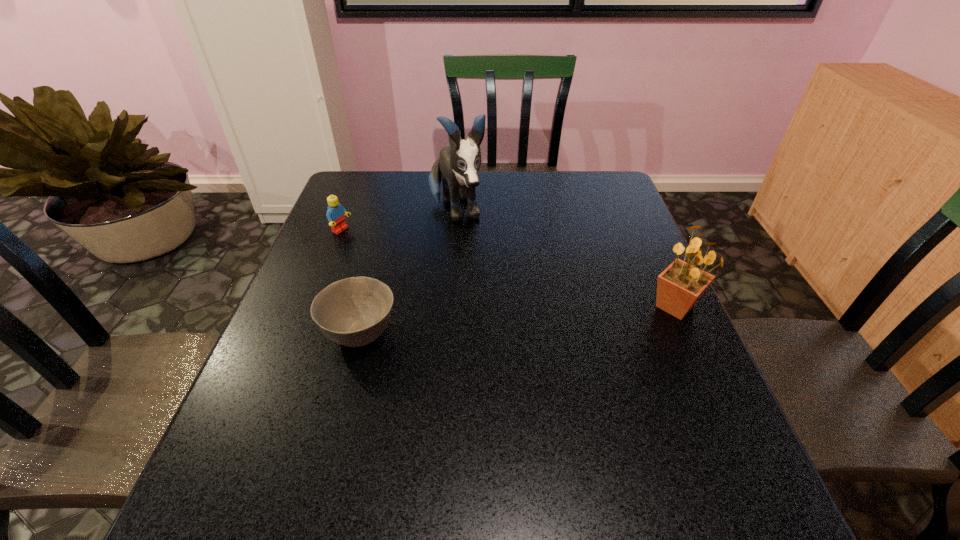
Where is `vacant area situated on the face of the Lego`? vacant area situated on the face of the Lego is located at coordinates (399, 258).

Locate an element on the screen. This screenshot has width=960, height=540. vacant space positioned on the front-facing side of the tallest object is located at coordinates (469, 254).

Where is `free spot located 0.070m on the front-facing side of the tallest object`? Image resolution: width=960 pixels, height=540 pixels. free spot located 0.070m on the front-facing side of the tallest object is located at coordinates click(x=469, y=254).

The width and height of the screenshot is (960, 540). I want to click on vacant space located on the front-facing side of the tallest object, so click(x=469, y=254).

At what (x,y) coordinates should I click in order to perform the action: click on object located at the far edge. Please return your answer as a coordinate pair (x, y). Looking at the image, I should click on (458, 165).

Where is `bowl that is at the left edge`? The image size is (960, 540). bowl that is at the left edge is located at coordinates (353, 312).

Find the location of `Lego that is at the left edge`. Lego that is at the left edge is located at coordinates (335, 214).

The image size is (960, 540). What are the coordinates of `object situated at the right edge` in the screenshot? It's located at (681, 284).

At what (x,y) coordinates should I click in order to perform the action: click on vacant space at the near edge of the desktop. Please return your answer as a coordinate pair (x, y). The width and height of the screenshot is (960, 540). Looking at the image, I should click on (332, 428).

The width and height of the screenshot is (960, 540). I want to click on vacant space at the left edge of the desktop, so click(343, 272).